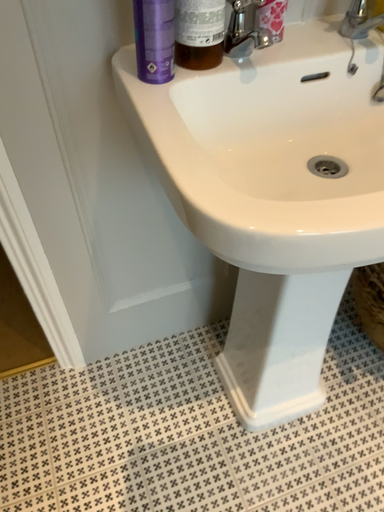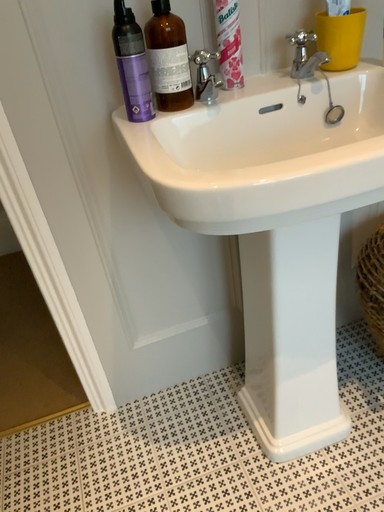
Question: Which way did the camera rotate in the video?

Choices:
 (A) rotated upward
 (B) rotated downward

Answer: (A)